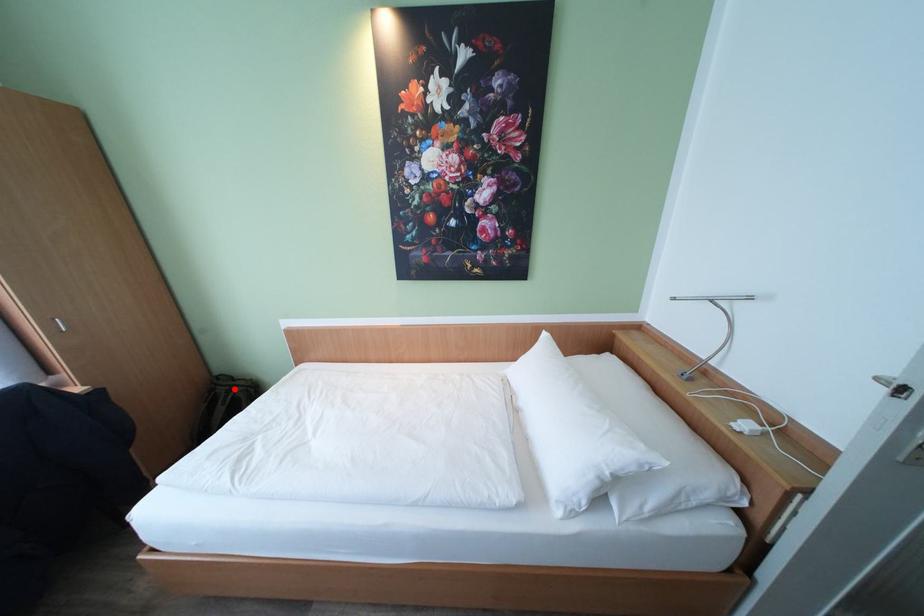
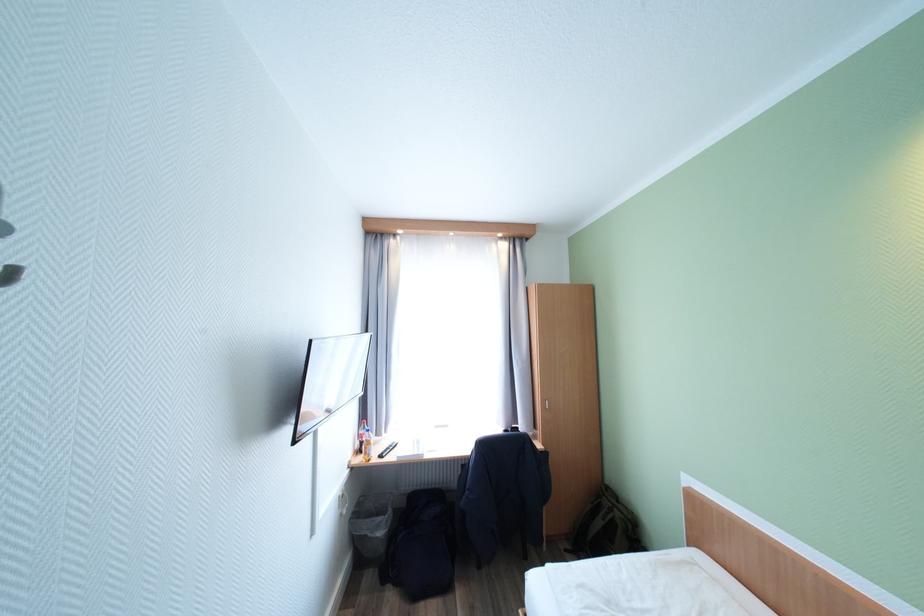
Where in the second image is the point corresponding to the highlighted location from the first image?

(617, 506)